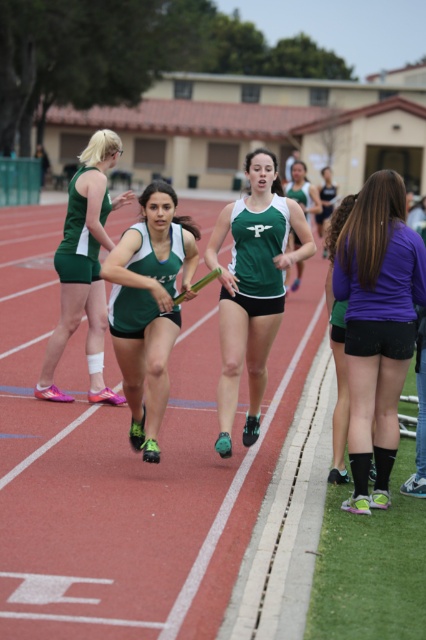
Question: Which object is closer to the camera taking this photo?

Choices:
 (A) green matte uniform at upper left
 (B) matte green uniform at center
 (C) purple matte shirt at center
 (D) green matte running uniform at center

Answer: (D)

Question: Can you confirm if green matte uniform at upper left is positioned to the right of green jersey at center?

Choices:
 (A) yes
 (B) no

Answer: (B)

Question: Does green matte running uniform at center appear over matte green uniform at center?

Choices:
 (A) no
 (B) yes

Answer: (A)

Question: Which of the following is the closest to the observer?

Choices:
 (A) green matte uniform at upper left
 (B) purple matte shirt at center
 (C) green jersey at center
 (D) purple matte shorts at lower right

Answer: (D)

Question: Which object is positioned farthest from the green matte uniform at upper left?

Choices:
 (A) purple matte shirt at center
 (B) matte green uniform at center
 (C) purple matte shorts at lower right
 (D) green matte running uniform at center

Answer: (A)

Question: Is purple matte shorts at lower right to the right of purple matte shirt at center from the viewer's perspective?

Choices:
 (A) no
 (B) yes

Answer: (A)